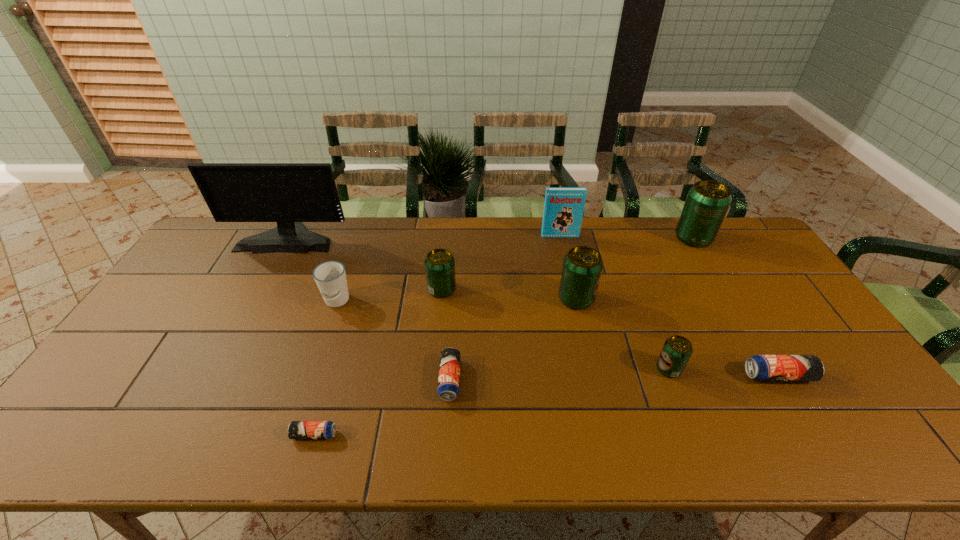
Where is `monitor`? The height and width of the screenshot is (540, 960). monitor is located at coordinates (287, 193).

At what (x,y) coordinates should I click in order to perform the action: click on the farthest beer can. Please return your answer as a coordinate pair (x, y). This screenshot has height=540, width=960. Looking at the image, I should click on (707, 202).

The height and width of the screenshot is (540, 960). I want to click on the rightmost green beer can, so [707, 202].

At what (x,y) coordinates should I click in order to perform the action: click on book. Please return your answer as a coordinate pair (x, y). The width and height of the screenshot is (960, 540). Looking at the image, I should click on (563, 210).

You are a GUI agent. You are given a task and a screenshot of the screen. Output one action in this format:
    pyautogui.click(x=<x>, y=<y>)
    Task: Click on the seventh shortest object
    Image resolution: width=960 pixels, height=540 pixels.
    Given the screenshot: What is the action you would take?
    pyautogui.click(x=582, y=267)

Identify the location of the third smallest green beer can. [x=582, y=267].

Find the location of a particular element. the third tallest beer can is located at coordinates (439, 263).

Identify the location of the leftmost green beer can. (439, 263).

This screenshot has width=960, height=540. Find the location of `white cup`. white cup is located at coordinates (330, 277).

This screenshot has height=540, width=960. In order to click on the seventh tallest object in this screenshot , I will do (677, 350).